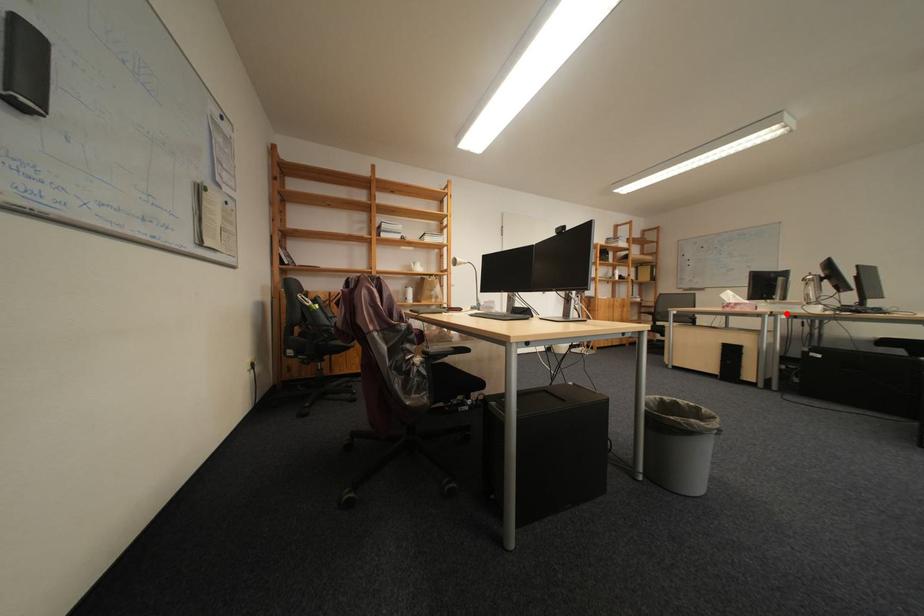
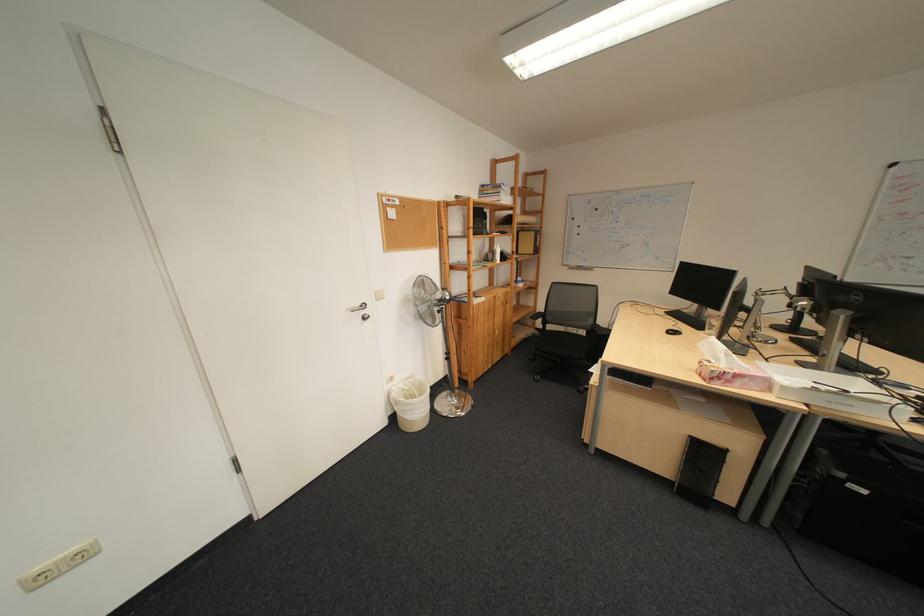
Question: I am providing you with two images of the same scene from different viewpoints. A red point is marked on the first image. Is the red point's position out of view in image 2?

Choices:
 (A) Yes
 (B) No

Answer: (B)